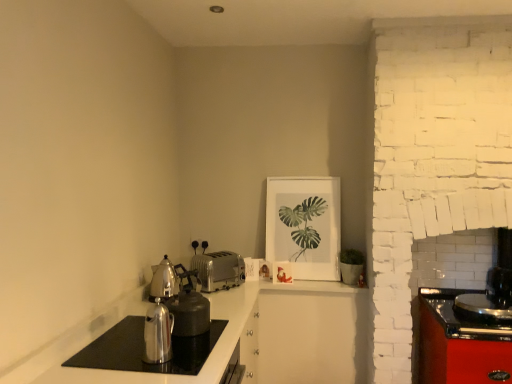
You are a GUI agent. You are given a task and a screenshot of the screen. Output one action in this format:
    pyautogui.click(x=<x>, y=<y>)
    Task: Click on the vacant area that is in front of shiny metallic kettle at lower left
    The height and width of the screenshot is (384, 512).
    Given the screenshot: What is the action you would take?
    pyautogui.click(x=154, y=374)